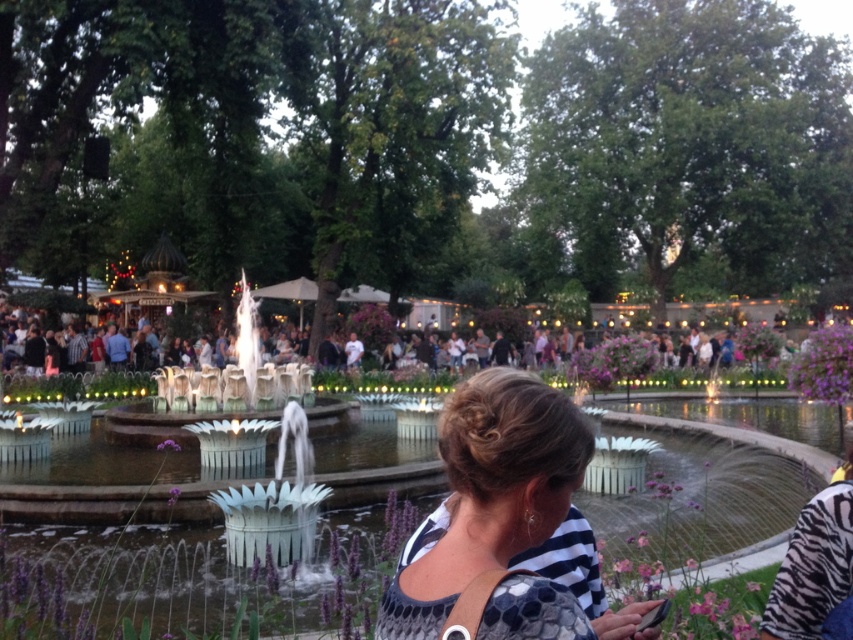
Question: Is purple fabric flower at lower right below purple matte flower at center?

Choices:
 (A) no
 (B) yes

Answer: (A)

Question: Is metallic fountain at center to the left of purple matte flower at center from the viewer's perspective?

Choices:
 (A) yes
 (B) no

Answer: (B)

Question: Can you confirm if white dotted blouse at center is positioned to the right of purple fabric flower at lower right?

Choices:
 (A) no
 (B) yes

Answer: (A)

Question: Which point is farther from the camera taking this photo?

Choices:
 (A) (158, 445)
 (B) (447, 522)
 (C) (820, 392)
 (D) (613, 577)

Answer: (A)

Question: Which object is closer to the camera taking this photo?

Choices:
 (A) purple fabric flower at lower right
 (B) metallic fountain at center

Answer: (B)

Question: Which of the following is the farthest from the observer?

Choices:
 (A) (817, 337)
 (B) (30, 580)
 (C) (555, 413)

Answer: (A)